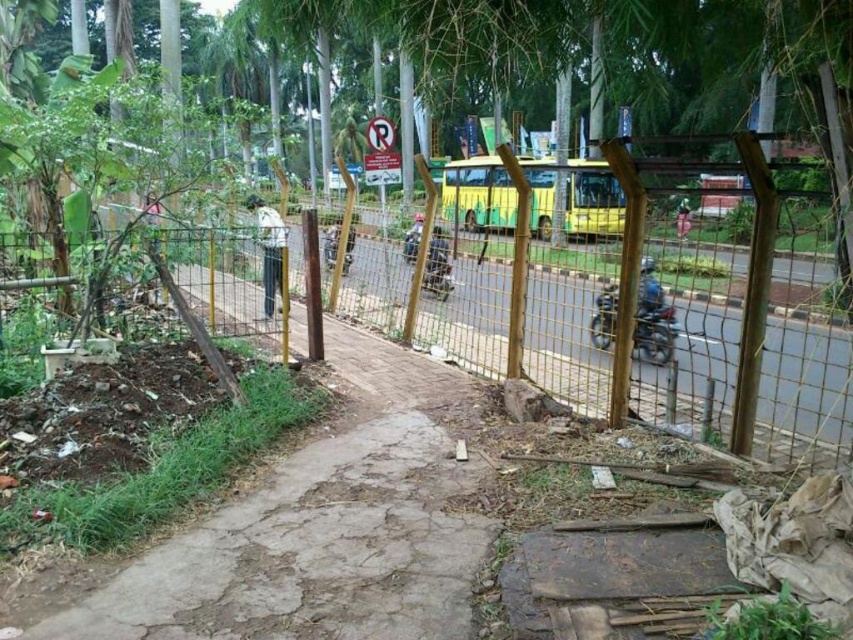
Does brown rough dirt track at lower left have a greater width compared to smooth black helmet at center?

Correct, the width of brown rough dirt track at lower left exceeds that of smooth black helmet at center.

Does point (349, 604) come in front of point (682, 204)?

That is True.

What do you see at coordinates (323, 525) in the screenshot?
I see `brown rough dirt track at lower left` at bounding box center [323, 525].

Where is `brown rough dirt track at lower left`? The image size is (853, 640). brown rough dirt track at lower left is located at coordinates (323, 525).

Between metallic silver motorcycle at center and smooth black helmet at center, which one is positioned higher?

smooth black helmet at center is higher up.

Which is behind, point (347, 260) or point (680, 230)?

Point (680, 230)

Identify the location of metallic silver motorcycle at center. tap(329, 244).

Is blue metallic helmet at center in front of metallic silver motorcycle at center?

Yes, blue metallic helmet at center is in front of metallic silver motorcycle at center.

Measure the distance between point (660, 305) and camera.

A distance of 6.00 meters exists between point (660, 305) and camera.

Locate an element on the screen. blue metallic helmet at center is located at coordinates (648, 298).

Where is `blue metallic helmet at center`? blue metallic helmet at center is located at coordinates (648, 298).